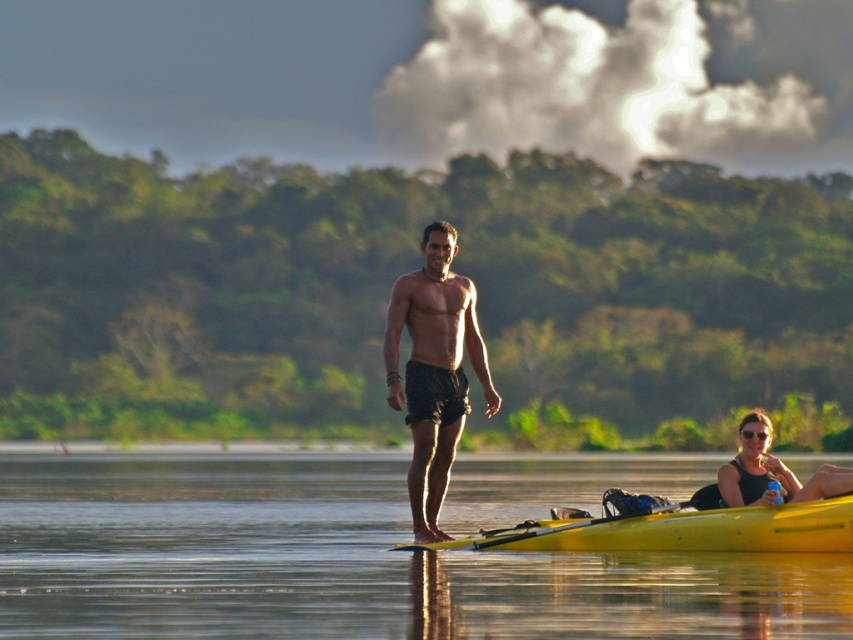
Question: Which point appears farthest from the camera in this image?

Choices:
 (A) (622, 524)
 (B) (258, 502)
 (C) (397, 547)

Answer: (B)

Question: Considering the relative positions of black matte shorts at center and yellow plastic paddle at lower center in the image provided, where is black matte shorts at center located with respect to yellow plastic paddle at lower center?

Choices:
 (A) left
 (B) right

Answer: (A)

Question: Can you confirm if transparent water at center is positioned to the left of yellow plastic paddle at lower center?

Choices:
 (A) no
 (B) yes

Answer: (B)

Question: Is transparent water at center bigger than yellow plastic paddle at lower center?

Choices:
 (A) yes
 (B) no

Answer: (A)

Question: Among these objects, which one is nearest to the camera?

Choices:
 (A) yellow plastic paddle at lower center
 (B) black matte shorts at center
 (C) transparent water at center
 (D) matte black tank top at lower right

Answer: (C)

Question: Among these points, which one is nearest to the camera?

Choices:
 (A) (173, 515)
 (B) (442, 336)

Answer: (B)